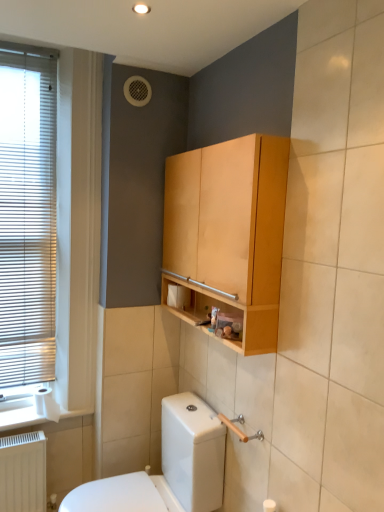
Locate an element on the screen. light brown wood cabinet at upper center is located at coordinates (229, 231).

You are a GUI agent. You are given a task and a screenshot of the screen. Output one action in this format:
    pyautogui.click(x=<x>, y=<y>)
    Task: Click on the white matte toilet paper at lower center, which is counted as the second toilet paper, starting from the left
    This screenshot has width=384, height=512.
    Given the screenshot: What is the action you would take?
    click(x=178, y=296)

Describe the element at coordinates (214, 316) in the screenshot. I see `metallic silver toiletries at center` at that location.

Where is `white glossy toilet at lower left`? white glossy toilet at lower left is located at coordinates (168, 467).

Considering the sizes of light brown wood cabinet at upper center and white glossy toilet at lower left in the image, is light brown wood cabinet at upper center taller or shorter than white glossy toilet at lower left?

Clearly, light brown wood cabinet at upper center is taller compared to white glossy toilet at lower left.

How much distance is there between light brown wood cabinet at upper center and white glossy toilet at lower left?

light brown wood cabinet at upper center is 28.82 inches from white glossy toilet at lower left.

Looking at their sizes, would you say light brown wood cabinet at upper center is wider or thinner than white glossy toilet at lower left?

Considering their sizes, light brown wood cabinet at upper center looks slimmer than white glossy toilet at lower left.

From a real-world perspective, is metallic silver toiletries at center beneath white blinds at left?

Yes, from a real-world perspective, metallic silver toiletries at center is below white blinds at left.

From the picture: Is metallic silver toiletries at center aimed at white blinds at left?

No, metallic silver toiletries at center is not oriented towards white blinds at left.

From a real-world perspective, does white glossy toilet at lower left stand above white matte toilet paper at lower center, which is the 1th toilet paper in top-to-bottom order?

Incorrect, from a real-world perspective, white glossy toilet at lower left is lower than white matte toilet paper at lower center, which is the 1th toilet paper in top-to-bottom order.

From the image's perspective, which one is positioned lower, white glossy toilet at lower left or white matte toilet paper at lower center, which is the 1th toilet paper in top-to-bottom order?

white glossy toilet at lower left is shown below in the image.

Who is more distant, white glossy toilet at lower left or white matte toilet paper at lower center, acting as the first toilet paper starting from the right?

white matte toilet paper at lower center, acting as the first toilet paper starting from the right, is further away from the camera.

In the image, there is a white matte toilet paper at lower center, which is the 1th toilet paper in top-to-bottom order. Find the location of `toilet below it (from a real-world perspective)`. toilet below it (from a real-world perspective) is located at coordinates (168, 467).

Considering the points (198, 271) and (39, 402), which point is in front, point (198, 271) or point (39, 402)?

Positioned in front is point (198, 271).

Can you tell me how much light brown wood cabinet at upper center and white matte toilet paper at lower left, the 2th toilet paper from the right, differ in facing direction?

The angle between the facing direction of light brown wood cabinet at upper center and the facing direction of white matte toilet paper at lower left, the 2th toilet paper from the right, is 87.3 degrees.

Which object is positioned more to the left, light brown wood cabinet at upper center or white matte toilet paper at lower left, the first toilet paper in the left-to-right sequence?

white matte toilet paper at lower left, the first toilet paper in the left-to-right sequence, is more to the left.

In the scene shown: Would you say white matte toilet paper at lower left, which ranks as the 1th toilet paper in bottom-to-top order, is part of light brown wood cabinet at upper center's contents?

No, white matte toilet paper at lower left, which ranks as the 1th toilet paper in bottom-to-top order, is located outside of light brown wood cabinet at upper center.

How many degrees apart are the facing directions of white blinds at left and white matte toilet paper at lower left, which ranks as the 1th toilet paper in bottom-to-top order?

The facing directions of white blinds at left and white matte toilet paper at lower left, which ranks as the 1th toilet paper in bottom-to-top order, are 3.17 degrees apart.

From the image's perspective, does white blinds at left appear higher than white matte toilet paper at lower left, which ranks as the 1th toilet paper in bottom-to-top order?

Yes, from the image's perspective, white blinds at left is above white matte toilet paper at lower left, which ranks as the 1th toilet paper in bottom-to-top order.

Choose the correct answer: Is white blinds at left inside white matte toilet paper at lower left, which ranks as the 1th toilet paper in bottom-to-top order, or outside it?

The correct answer is: outside.

Does white blinds at left have a larger size compared to white matte toilet paper at lower left, which ranks as the 1th toilet paper in bottom-to-top order?

Indeed, white blinds at left has a larger size compared to white matte toilet paper at lower left, which ranks as the 1th toilet paper in bottom-to-top order.

Is white matte toilet paper at lower center, acting as the first toilet paper starting from the right, not close to white matte toilet paper at lower left, the second toilet paper in the top-to-bottom sequence?

white matte toilet paper at lower center, acting as the first toilet paper starting from the right, is near white matte toilet paper at lower left, the second toilet paper in the top-to-bottom sequence, not far away.

Considering the sizes of objects white matte toilet paper at lower center, which is counted as the second toilet paper, starting from the left, and white matte toilet paper at lower left, the 2th toilet paper from the right, in the image provided, who is bigger, white matte toilet paper at lower center, which is counted as the second toilet paper, starting from the left, or white matte toilet paper at lower left, the 2th toilet paper from the right,?

white matte toilet paper at lower left, the 2th toilet paper from the right.

Which is closer to the camera, (184, 301) or (36, 392)?

The point (184, 301) is in front.

Considering the relative sizes of white matte toilet paper at lower center, which is the second toilet paper from bottom to top, and white matte toilet paper at lower left, the first toilet paper in the left-to-right sequence, in the image provided, is white matte toilet paper at lower center, which is the second toilet paper from bottom to top, thinner than white matte toilet paper at lower left, the first toilet paper in the left-to-right sequence,?

Yes, white matte toilet paper at lower center, which is the second toilet paper from bottom to top, is thinner than white matte toilet paper at lower left, the first toilet paper in the left-to-right sequence.

Looking at their sizes, would you say white matte toilet paper at lower left, the second toilet paper in the top-to-bottom sequence, is wider or thinner than light brown wood cabinet at upper center?

Considering their sizes, white matte toilet paper at lower left, the second toilet paper in the top-to-bottom sequence, looks slimmer than light brown wood cabinet at upper center.

From the image's perspective, is white matte toilet paper at lower left, the 2th toilet paper from the right, located beneath light brown wood cabinet at upper center?

Yes, from the image's perspective, white matte toilet paper at lower left, the 2th toilet paper from the right, is below light brown wood cabinet at upper center.

Which of these two, white matte toilet paper at lower left, which ranks as the 1th toilet paper in bottom-to-top order, or light brown wood cabinet at upper center, is bigger?

light brown wood cabinet at upper center.

Is white matte toilet paper at lower left, the first toilet paper in the left-to-right sequence, positioned far away from light brown wood cabinet at upper center?

Yes, white matte toilet paper at lower left, the first toilet paper in the left-to-right sequence, and light brown wood cabinet at upper center are quite far apart.

Locate an element on the screen. bathroom cabinet above the white glossy toilet at lower left (from a real-world perspective) is located at coordinates (229, 231).

Identify the location of window behind the metallic silver toiletries at center. The height and width of the screenshot is (512, 384). (27, 213).

When comparing their distances from white matte toilet paper at lower left, the first toilet paper in the left-to-right sequence, does white matte toilet paper at lower center, which is the 1th toilet paper in top-to-bottom order, or white blinds at left seem further?

white matte toilet paper at lower center, which is the 1th toilet paper in top-to-bottom order.

When comparing their distances from white matte toilet paper at lower left, which ranks as the 1th toilet paper in bottom-to-top order, does metallic silver toiletries at center or white blinds at left seem further?

The object further to white matte toilet paper at lower left, which ranks as the 1th toilet paper in bottom-to-top order, is metallic silver toiletries at center.

From the picture: When comparing their distances from white matte toilet paper at lower left, the 2th toilet paper from the right, does light brown wood cabinet at upper center or white matte toilet paper at lower center, acting as the first toilet paper starting from the right, seem closer?

Among the two, white matte toilet paper at lower center, acting as the first toilet paper starting from the right, is located nearer to white matte toilet paper at lower left, the 2th toilet paper from the right.

Estimate the real-world distances between objects in this image. Which object is further from white matte toilet paper at lower left, the 2th toilet paper from the right, white glossy toilet at lower left or white matte toilet paper at lower center, which is counted as the second toilet paper, starting from the left?

white matte toilet paper at lower center, which is counted as the second toilet paper, starting from the left, is further to white matte toilet paper at lower left, the 2th toilet paper from the right.

From the image, which object appears to be farther from white blinds at left, white matte toilet paper at lower left, the first toilet paper in the left-to-right sequence, or light brown wood cabinet at upper center?

light brown wood cabinet at upper center.

Looking at the image, which one is located closer to white blinds at left, white matte toilet paper at lower center, which is the second toilet paper from bottom to top, or white matte toilet paper at lower left, the 2th toilet paper from the right?

white matte toilet paper at lower left, the 2th toilet paper from the right.

Considering their positions, is metallic silver toiletries at center positioned closer to white blinds at left than white matte toilet paper at lower left, the second toilet paper in the top-to-bottom sequence?

Among the two, white matte toilet paper at lower left, the second toilet paper in the top-to-bottom sequence, is located nearer to white blinds at left.

Which object lies further to the anchor point light brown wood cabinet at upper center, metallic silver toiletries at center or white matte toilet paper at lower center, which is counted as the second toilet paper, starting from the left?

white matte toilet paper at lower center, which is counted as the second toilet paper, starting from the left, lies further to light brown wood cabinet at upper center than the other object.

Locate an element on the screen. toiletry between light brown wood cabinet at upper center and white glossy toilet at lower left from top to bottom is located at coordinates (214, 316).

Where is `toilet paper between white matte toilet paper at lower left, the 2th toilet paper from the right, and light brown wood cabinet at upper center`? The width and height of the screenshot is (384, 512). toilet paper between white matte toilet paper at lower left, the 2th toilet paper from the right, and light brown wood cabinet at upper center is located at coordinates (178, 296).

Where is `toiletry between white blinds at left and white glossy toilet at lower left vertically`? The image size is (384, 512). toiletry between white blinds at left and white glossy toilet at lower left vertically is located at coordinates (214, 316).

Locate an element on the screen. The height and width of the screenshot is (512, 384). toiletry between light brown wood cabinet at upper center and white matte toilet paper at lower center, which is counted as the second toilet paper, starting from the left, from front to back is located at coordinates (214, 316).